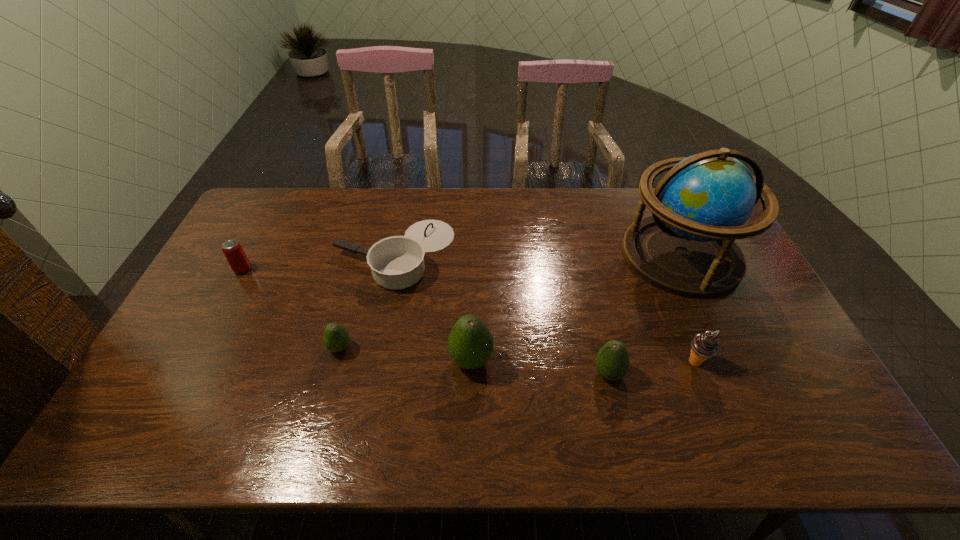
Where is `free space located on the right of the fourth object from left to right`? free space located on the right of the fourth object from left to right is located at coordinates (535, 360).

You are a GUI agent. You are given a task and a screenshot of the screen. Output one action in this format:
    pyautogui.click(x=<x>, y=<y>)
    Task: Click on the free space located on the left of the rightmost avocado
    
    Given the screenshot: What is the action you would take?
    pyautogui.click(x=472, y=374)

Image resolution: width=960 pixels, height=540 pixels. I want to click on free location located on the right of the beer can, so click(314, 269).

I want to click on free point located 0.070m on the front of the globe, so click(x=709, y=318).

Find the location of a particular element. The image size is (960, 540). vacant position located on the back of the icecream is located at coordinates (680, 323).

Locate an element on the screen. The image size is (960, 540). vacant region located on the front of the shortest object is located at coordinates tap(378, 336).

Identify the location of globe that is positioned at the far edge. This screenshot has height=540, width=960. (687, 247).

Identify the location of saucepan that is at the far edge. The height and width of the screenshot is (540, 960). (397, 262).

I want to click on object at the left edge, so click(x=234, y=253).

The height and width of the screenshot is (540, 960). Find the location of `object at the right edge`. object at the right edge is located at coordinates (687, 247).